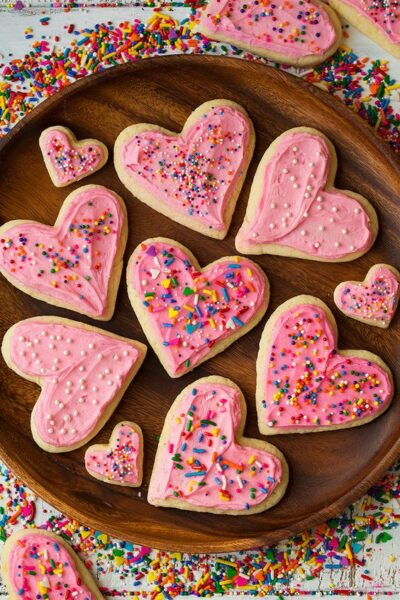
Locate an element on the screen. table is located at coordinates (12, 24).